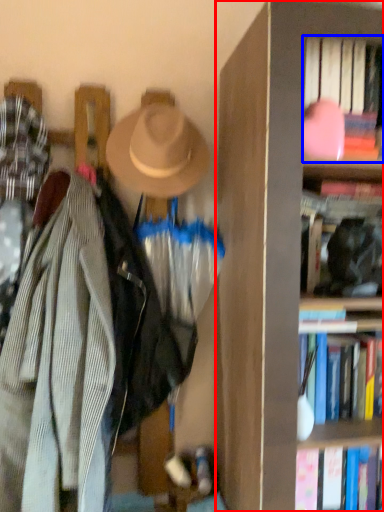
Question: Among these objects, which one is nearest to the camera, bookcase (highlighted by a red box) or book (highlighted by a blue box)?

Choices:
 (A) bookcase
 (B) book

Answer: (A)